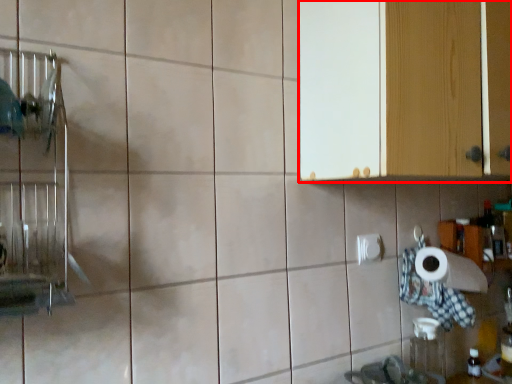
Question: From the image, what is the correct spatial relationship of cabinetry (annotated by the red box) in relation to toilet paper?

Choices:
 (A) left
 (B) right

Answer: (B)